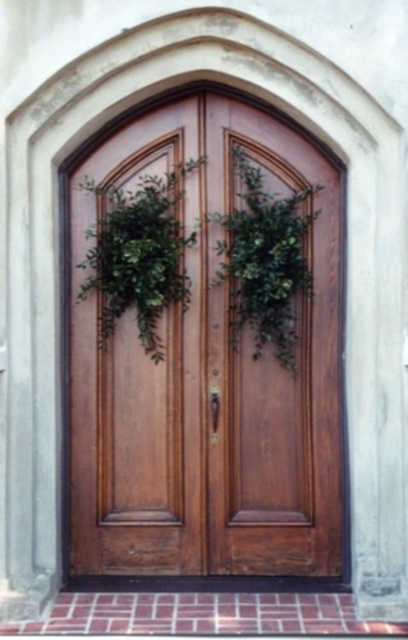
You are a visitor approaching the entrance with the wooden double doors. You notice two green leafy items at the center. Which one is shorter between the green leafy wreath at center and the green leafy plant at center?

The green leafy wreath at center is not as tall as the green leafy plant at center, so the green leafy wreath at center is shorter.

Consider the image. You are standing in front of the wooden double doors and want to touch both the green leafy wreath at center and the green leafy plant at center. Which one would you reach first?

The green leafy wreath at center is closer to you, so you can reach it first before the green leafy plant at center.

You are standing in front of the wooden double doors and want to place a decoration at point (164, 472) and another at point (250, 214). Which point is closer to the viewer?

Point (250, 214) is closer to the viewer because point (164, 472) is behind it.